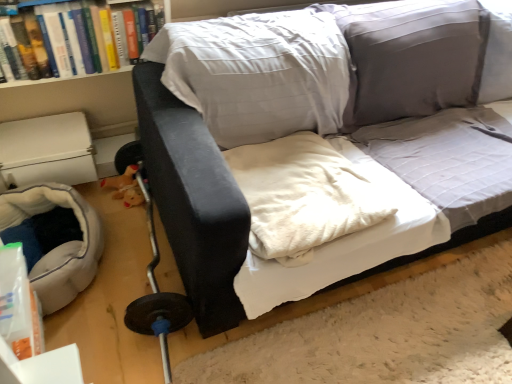
Question: Is hardcover book at upper left bigger than soft gray fabric bean bag at lower left?

Choices:
 (A) yes
 (B) no

Answer: (B)

Question: Does hardcover book at upper left have a greater height compared to soft gray fabric bean bag at lower left?

Choices:
 (A) no
 (B) yes

Answer: (B)

Question: From a real-world perspective, is hardcover book at upper left positioned over soft gray fabric bean bag at lower left based on gravity?

Choices:
 (A) yes
 (B) no

Answer: (A)

Question: Can you confirm if hardcover book at upper left is positioned to the right of soft gray fabric bean bag at lower left?

Choices:
 (A) yes
 (B) no

Answer: (A)

Question: Is soft gray fabric bean bag at lower left completely or partially inside hardcover book at upper left?

Choices:
 (A) yes
 (B) no

Answer: (B)

Question: Does hardcover book at upper left turn towards soft gray fabric bean bag at lower left?

Choices:
 (A) no
 (B) yes

Answer: (A)

Question: Considering the relative sizes of hardcover book at upper left and white soft blanket at center in the image provided, is hardcover book at upper left taller than white soft blanket at center?

Choices:
 (A) yes
 (B) no

Answer: (A)

Question: Is hardcover book at upper left wider than white soft blanket at center?

Choices:
 (A) no
 (B) yes

Answer: (A)

Question: From the image's perspective, does hardcover book at upper left appear higher than white soft blanket at center?

Choices:
 (A) yes
 (B) no

Answer: (A)

Question: Does hardcover book at upper left come in front of white soft blanket at center?

Choices:
 (A) no
 (B) yes

Answer: (A)

Question: Considering the relative sizes of hardcover book at upper left and white soft blanket at center in the image provided, is hardcover book at upper left smaller than white soft blanket at center?

Choices:
 (A) yes
 (B) no

Answer: (A)

Question: Considering the relative sizes of hardcover book at upper left and white soft blanket at center in the image provided, is hardcover book at upper left thinner than white soft blanket at center?

Choices:
 (A) yes
 (B) no

Answer: (A)

Question: From a real-world perspective, does hardcover book at upper left stand above velvet black couch at center?

Choices:
 (A) yes
 (B) no

Answer: (A)